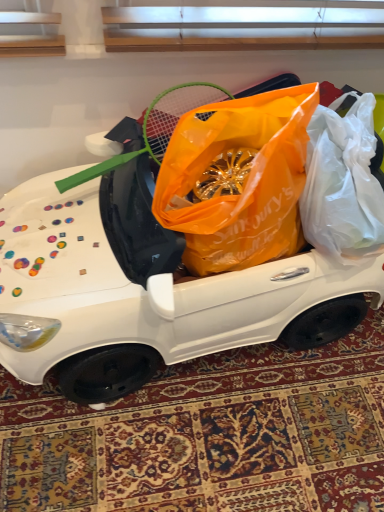
At what (x,y) coordinates should I click in order to perform the action: click on white plastic car at center. Please return your answer as a coordinate pair (x, y). The width and height of the screenshot is (384, 512). Looking at the image, I should click on (146, 298).

What do you see at coordinates (146, 298) in the screenshot?
I see `white plastic car at center` at bounding box center [146, 298].

Where is `white plastic car at center`? This screenshot has width=384, height=512. white plastic car at center is located at coordinates (146, 298).